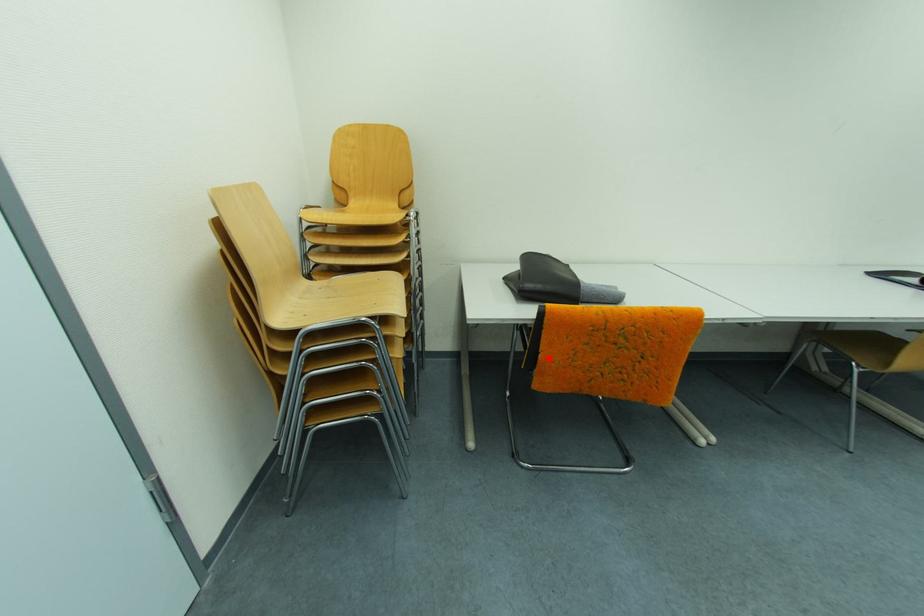
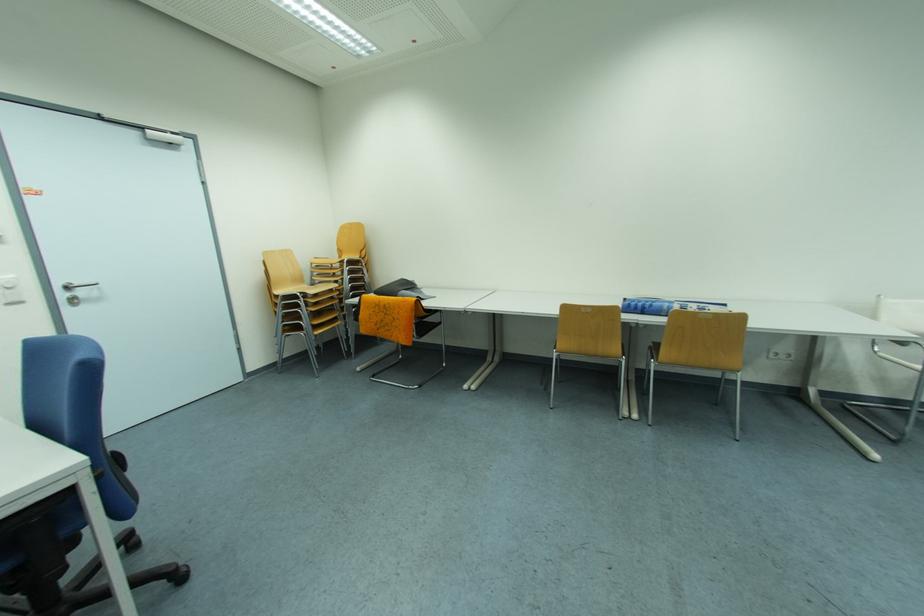
Find the pixel in the second image that matches the highlighted location in the first image.

(369, 318)